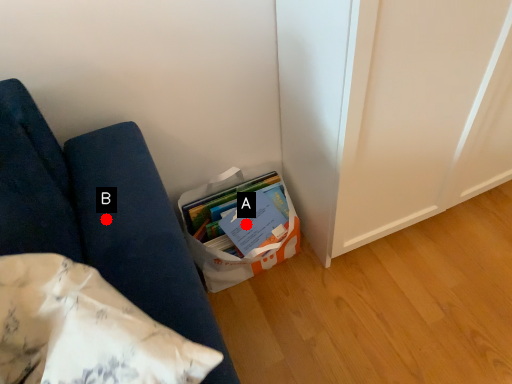
Question: Two points are circled on the image, labeled by A and B beside each circle. Which point is closer to the camera?

Choices:
 (A) A is closer
 (B) B is closer

Answer: (B)